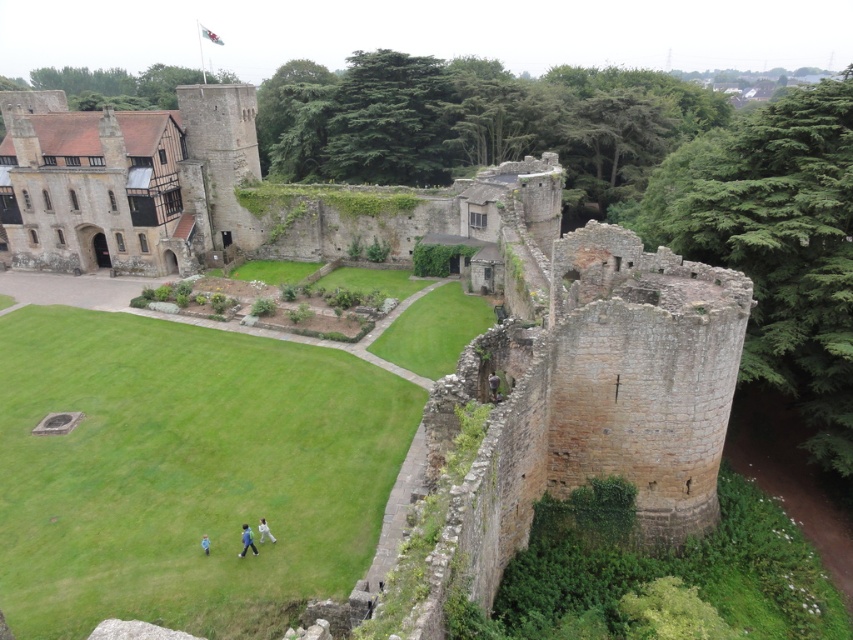
Based on the photo, you are standing in the courtyard of the historic castle and see a brown leather jacket at center and a blue fabric person at lower left. Which object is closer to you?

The brown leather jacket at center is closer to you because the blue fabric person at lower left is behind it.

You are standing at the entrance of the historic castle surrounded by lush greenery under overcast skies. The castle has weathered stone walls with a prominent cylindrical tower on the right side covered in ivy. There is a courtyard with well maintained grass, pathways, neatly trimmed hedges and flowerbeds. You see a point marked at coordinate [264,531]. What object is located at that coordinate?

The point at coordinate [264,531] marks the location of the white fabric at center.

You are a visitor exploring the castle grounds and notice the brown stone fort at left and the brown leather jacket at center. Which object is closer to you as you stand in the courtyard?

The brown leather jacket at center is behind the brown stone fort at left, so the brown stone fort at left is closer to you.